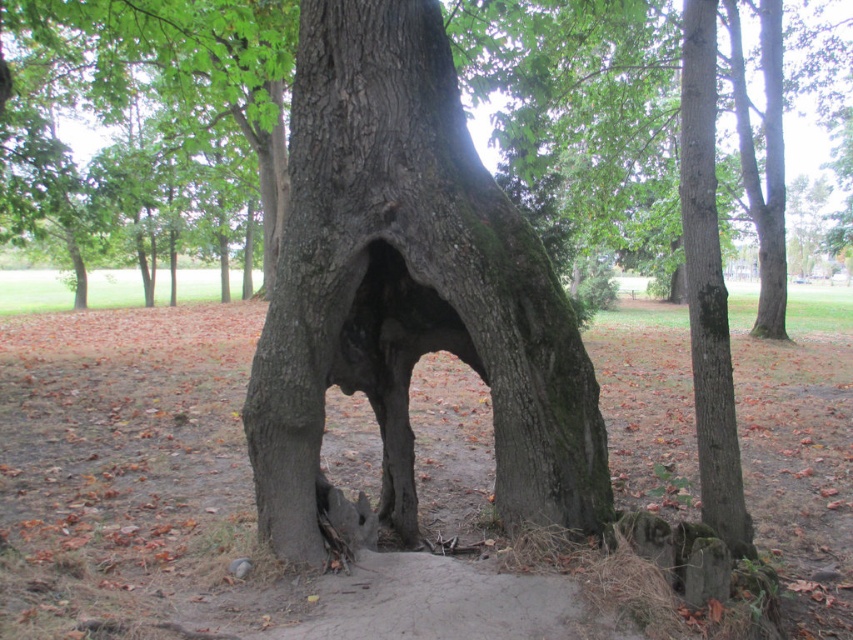
You are standing in the natural scene and want to take a photo of both the smooth bark tree trunk at right and the dark gray bark hole at center. Which object should you adjust your camera angle to focus on first to ensure both are in the frame?

The smooth bark tree trunk at right is much taller than the dark gray bark hole at center, so you should focus on the smooth bark tree trunk at right first to ensure both are in the frame.

You are standing in front of the large tree with the arch formation. You notice two points marked on the tree trunk. The first point is at coordinates point [575,486] and the second is at point [682,125]. Which of these points is closer to you?

Point [575,486] is closer to the viewer than point [682,125].